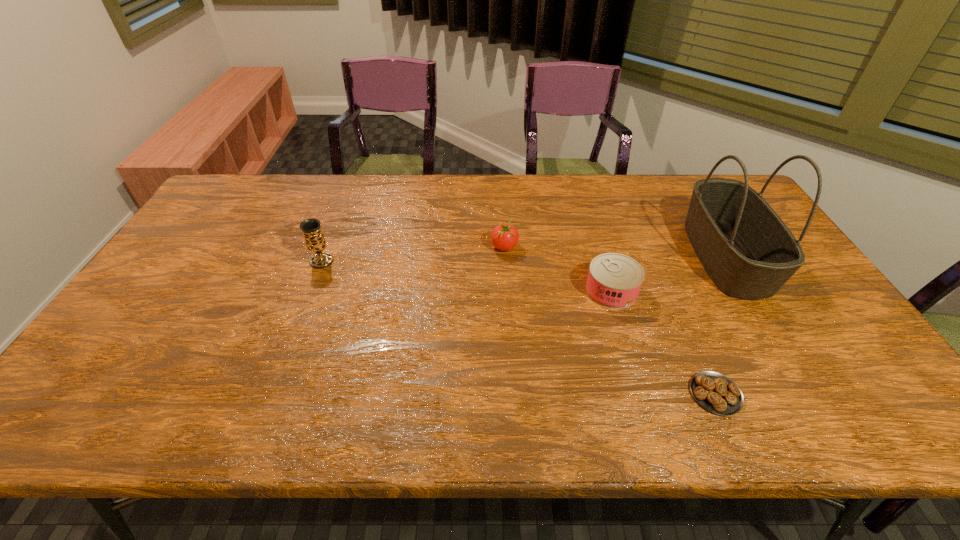
Where is `object that is the fourth closest to the third object from left to right`? The width and height of the screenshot is (960, 540). object that is the fourth closest to the third object from left to right is located at coordinates (311, 228).

This screenshot has width=960, height=540. In order to click on object that stands as the closest to the tallest object in this screenshot , I will do `click(614, 280)`.

You are a GUI agent. You are given a task and a screenshot of the screen. Output one action in this format:
    pyautogui.click(x=<x>, y=<y>)
    Task: Click on the free location that satisfies the following two spatial constraints: 1. on the back side of the rightmost object; 2. on the left side of the third object from right to left
    This screenshot has height=540, width=960.
    Given the screenshot: What is the action you would take?
    pyautogui.click(x=601, y=255)

This screenshot has width=960, height=540. Find the location of `vacant space that satisfies the following two spatial constraints: 1. on the back side of the tallest object; 2. on the right side of the second object from right to left`. vacant space that satisfies the following two spatial constraints: 1. on the back side of the tallest object; 2. on the right side of the second object from right to left is located at coordinates click(656, 255).